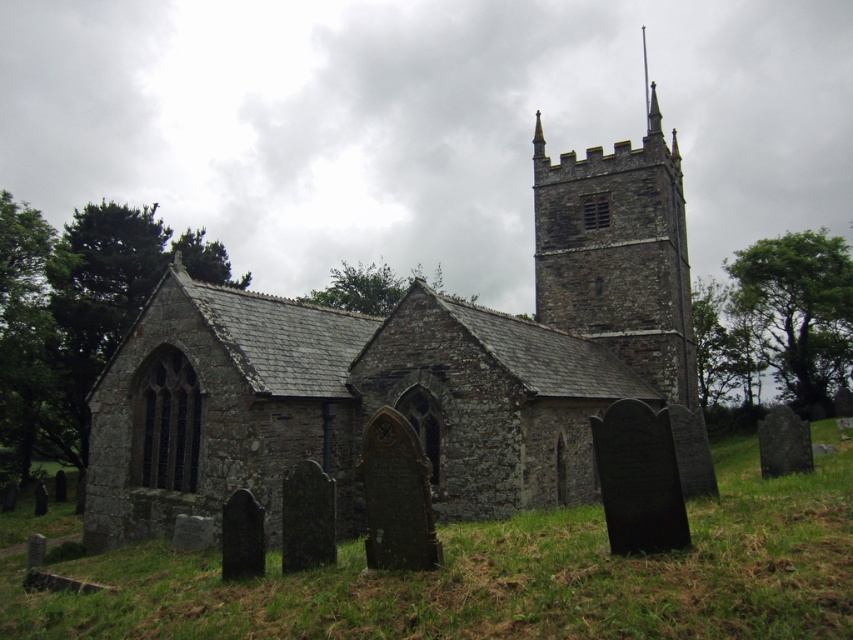
You are planning to place a new gravestone in the graveyard. The gravestone must be placed within the green grass at lower center. Given the size of the stone church at center, will there be enough space to place the gravestone without it being under the church?

The stone church at center is wider than the green grass at lower center, so placing the gravestone within the green grass at lower center may not leave enough space as the church occupies a larger area. Check the exact measurements before deciding.

You are a visitor standing in front of the stone church at center and the rustic stone tower at upper center. Which structure appears larger in size?

The rustic stone tower at upper center appears larger in size compared to the stone church at center.

You are a gardener planning to mow the green grass at lower center and the rustic stone tower at upper center. Which area requires more attention in terms of space coverage?

The green grass at lower center requires less attention because it occupies less space than the rustic stone tower at upper center.